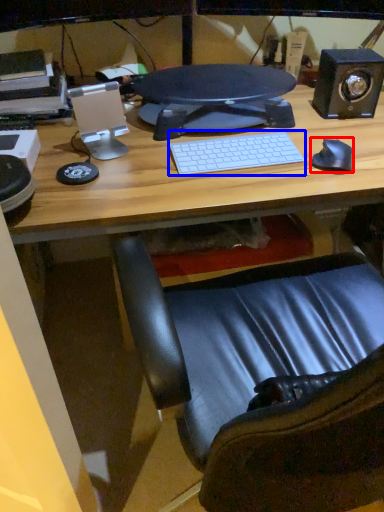
Question: Among these objects, which one is farthest to the camera, mouse (highlighted by a red box) or computer keyboard (highlighted by a blue box)?

Choices:
 (A) mouse
 (B) computer keyboard

Answer: (B)